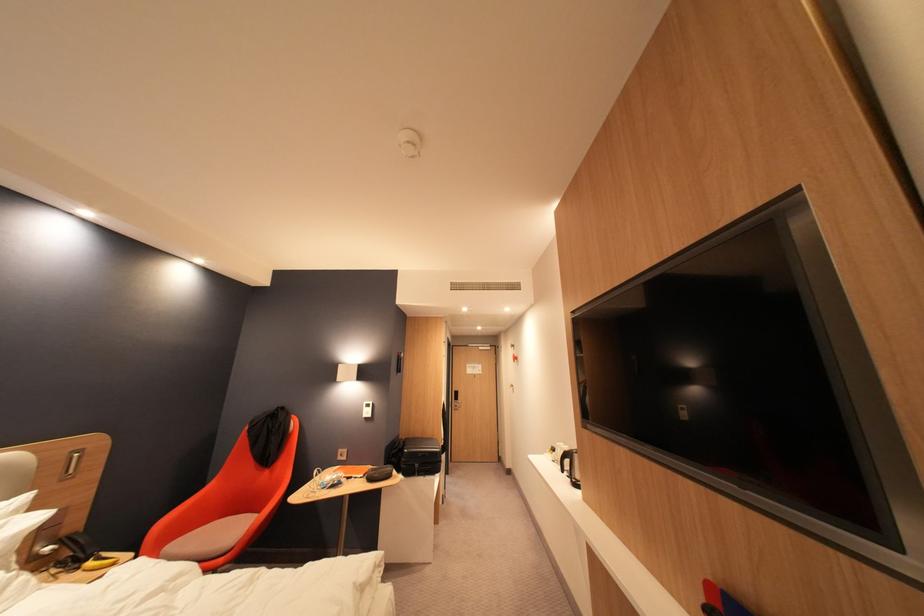
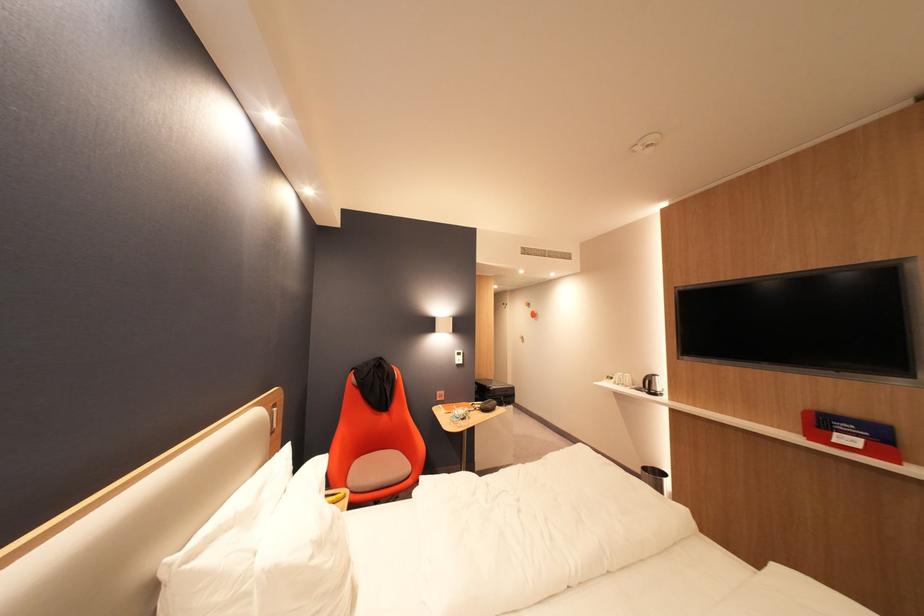
Where in the second image is the point corresponding to the point at 584,482 from the first image?

(662, 392)